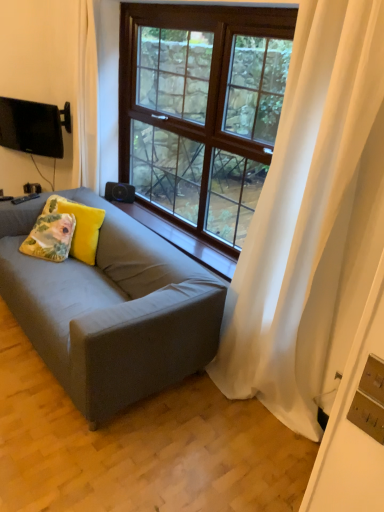
The image size is (384, 512). Identify the location of empty space that is ontop of wooden at center. (190, 234).